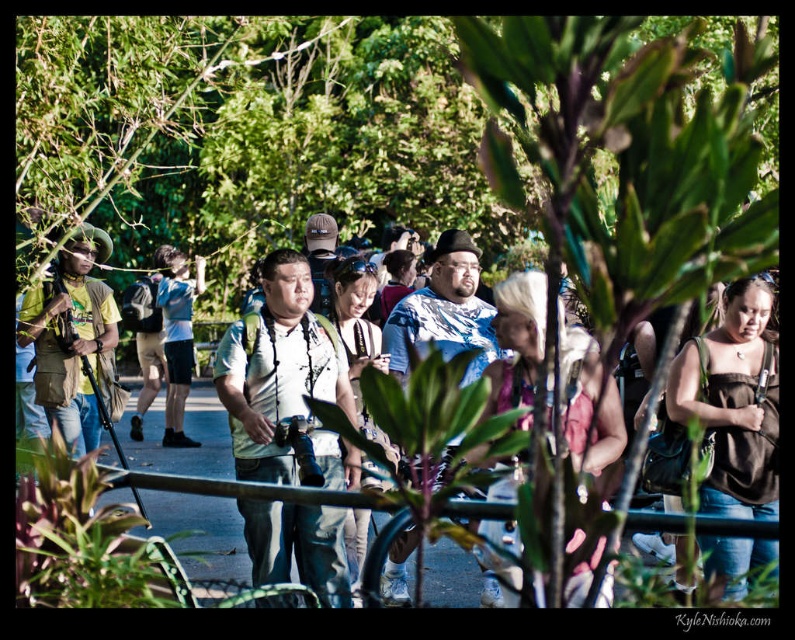
Is light brown leather jacket at center shorter than blue denim shorts at center?

Indeed, light brown leather jacket at center has a lesser height compared to blue denim shorts at center.

Is light brown leather jacket at center closer to the viewer compared to blue denim shorts at center?

Yes, it is in front of blue denim shorts at center.

Measure the distance between point (367, 476) and camera.

Answer: Point (367, 476) is 13.21 meters away from camera.

The image size is (795, 640). What are the coordinates of `light brown leather jacket at center` in the screenshot? It's located at (359, 336).

Does pink fabric purse at center come in front of blue patterned shirt at center?

Yes, it is.

This screenshot has width=795, height=640. What do you see at coordinates (586, 401) in the screenshot?
I see `pink fabric purse at center` at bounding box center [586, 401].

I want to click on pink fabric purse at center, so click(586, 401).

Is pink fabric purse at center smaller than blue denim shorts at center?

Yes.

Which of these two, pink fabric purse at center or blue denim shorts at center, stands shorter?

With less height is pink fabric purse at center.

Is point (572, 388) farther from viewer compared to point (185, 282)?

No, (572, 388) is closer to viewer.

Locate an element on the screen. pink fabric purse at center is located at coordinates [586, 401].